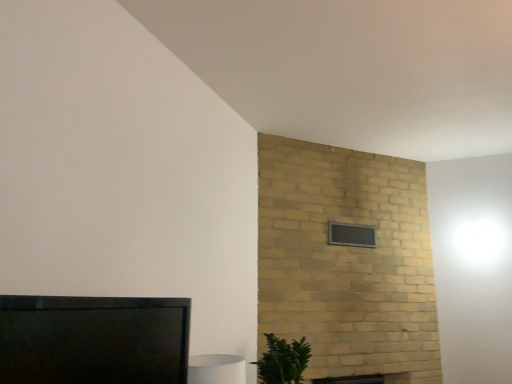
Where is `matte black tv at lower left`? This screenshot has width=512, height=384. matte black tv at lower left is located at coordinates (93, 340).

Image resolution: width=512 pixels, height=384 pixels. Describe the element at coordinates (93, 340) in the screenshot. I see `matte black tv at lower left` at that location.

Describe the element at coordinates (283, 361) in the screenshot. The width and height of the screenshot is (512, 384). I see `green leafy plant at lower right` at that location.

What is the approximate width of green leafy plant at lower right?

It is 13.14 inches.

Where is `matte black tv at lower left`? matte black tv at lower left is located at coordinates (93, 340).

Is matte black tv at lower left oriented away from green leafy plant at lower right?

No, matte black tv at lower left's orientation is not away from green leafy plant at lower right.

From a real-world perspective, between matte black tv at lower left and green leafy plant at lower right, who is vertically higher?

matte black tv at lower left is physically above.

In the scene shown: Which object is wider, matte black tv at lower left or green leafy plant at lower right?

green leafy plant at lower right.

Is point (62, 348) farther from viewer compared to point (289, 364)?

No, (62, 348) is closer to viewer.

How distant is green leafy plant at lower right from matte black tv at lower left?

They are 1.26 meters apart.

Which is in front, point (267, 354) or point (0, 306)?

The point (0, 306) is closer to the camera.

Is green leafy plant at lower right next to matte black tv at lower left?

They are not placed beside each other.

From a real-world perspective, which is physically below, green leafy plant at lower right or matte black tv at lower left?

A: In real-world perspective, green leafy plant at lower right is lower.

Who is taller, green leafy plant at lower right or black glass window at upper center?

Standing taller between the two is green leafy plant at lower right.

The image size is (512, 384). What are the coordinates of `window that appears on the right of green leafy plant at lower right` in the screenshot? It's located at (351, 234).

From the image's perspective, is green leafy plant at lower right located above or below black glass window at upper center?

From the image's perspective, green leafy plant at lower right appears below black glass window at upper center.

Does point (365, 225) come farther from viewer compared to point (144, 365)?

Yes, it is.

Which is in front, black glass window at upper center or matte black tv at lower left?

matte black tv at lower left is closer to the camera.

Who is bigger, black glass window at upper center or matte black tv at lower left?

Bigger between the two is matte black tv at lower left.

Is black glass window at upper center shorter than matte black tv at lower left?

Yes, black glass window at upper center is shorter than matte black tv at lower left.

Is black glass window at upper center oriented away from green leafy plant at lower right?

No, black glass window at upper center's orientation is not away from green leafy plant at lower right.

Considering the relative positions of black glass window at upper center and green leafy plant at lower right in the image provided, is black glass window at upper center to the right of green leafy plant at lower right from the viewer's perspective?

Indeed, black glass window at upper center is positioned on the right side of green leafy plant at lower right.

Consider the image. From the image's perspective, who appears lower, black glass window at upper center or green leafy plant at lower right?

green leafy plant at lower right appears lower in the image.

Between black glass window at upper center and green leafy plant at lower right, which one is positioned in front?

Positioned in front is green leafy plant at lower right.

Which object is positioned more to the left, matte black tv at lower left or black glass window at upper center?

matte black tv at lower left.

Is the depth of matte black tv at lower left less than that of black glass window at upper center?

Yes, matte black tv at lower left is in front of black glass window at upper center.

From the image's perspective, which object appears higher, matte black tv at lower left or black glass window at upper center?

black glass window at upper center.

Is matte black tv at lower left wider or thinner than black glass window at upper center?

matte black tv at lower left is wider than black glass window at upper center.

Locate an element on the screen. The image size is (512, 384). furniture that appears on the left of green leafy plant at lower right is located at coordinates (93, 340).

The image size is (512, 384). What are the coordinates of `houseplant that is below the matte black tv at lower left (from the image's perspective)` in the screenshot? It's located at (283, 361).

When comparing their distances from green leafy plant at lower right, does matte black tv at lower left or black glass window at upper center seem closer?

black glass window at upper center is closer to green leafy plant at lower right.

Estimate the real-world distances between objects in this image. Which object is closer to black glass window at upper center, green leafy plant at lower right or matte black tv at lower left?

green leafy plant at lower right is closer to black glass window at upper center.

Looking at the image, which one is located further to matte black tv at lower left, green leafy plant at lower right or black glass window at upper center?

black glass window at upper center is positioned further to the anchor matte black tv at lower left.

When comparing their distances from matte black tv at lower left, does black glass window at upper center or green leafy plant at lower right seem further?

black glass window at upper center.

Looking at the image, which one is located further to black glass window at upper center, matte black tv at lower left or green leafy plant at lower right?

matte black tv at lower left is further to black glass window at upper center.

Based on their spatial positions, is black glass window at upper center or matte black tv at lower left closer to green leafy plant at lower right?

Among the two, black glass window at upper center is located nearer to green leafy plant at lower right.

Identify the location of houseplant between matte black tv at lower left and black glass window at upper center in the front-back direction. The image size is (512, 384). (283, 361).